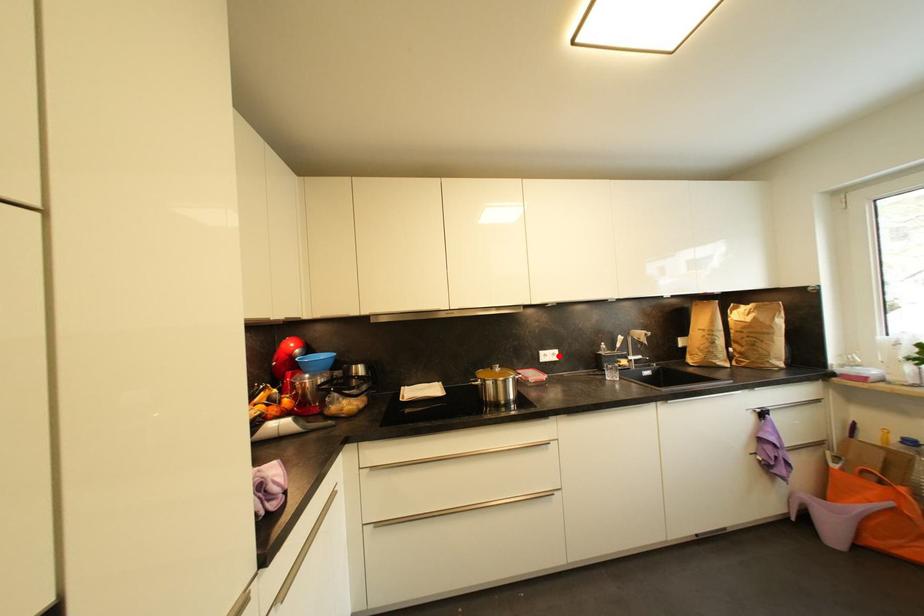
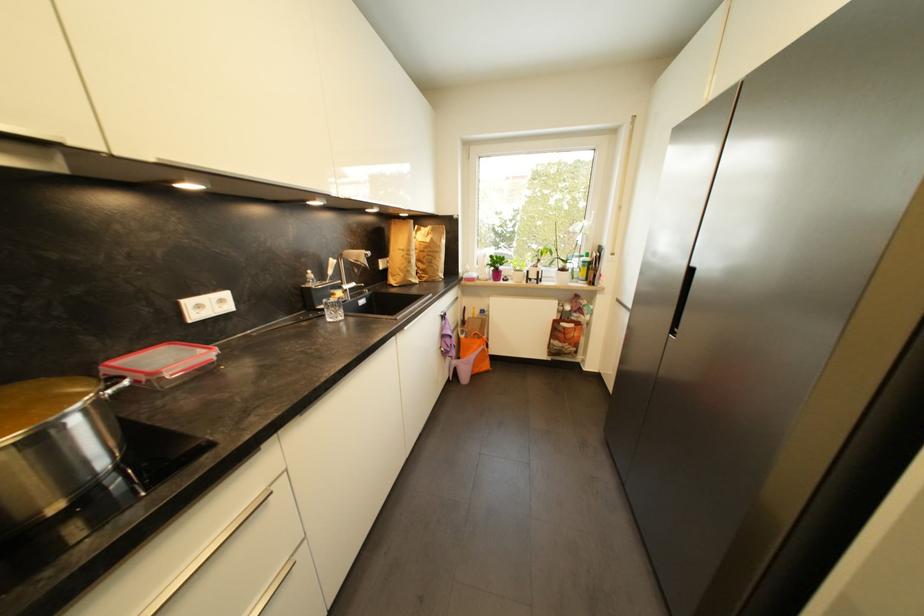
The point at the highlighted location is marked in the first image. Where is the corresponding point in the second image?

(226, 302)